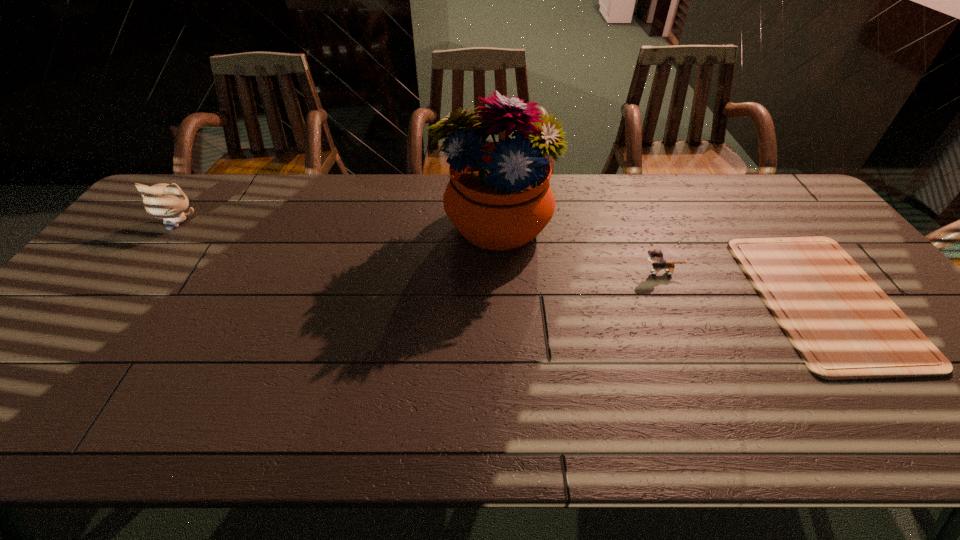
You are a GUI agent. You are given a task and a screenshot of the screen. Output one action in this format:
    pyautogui.click(x=<x>, y=<y>)
    Task: Click on the empty space that is in between the taller kitten and the right kitten
    This screenshot has height=540, width=960.
    Given the screenshot: What is the action you would take?
    pyautogui.click(x=420, y=247)

The image size is (960, 540). In order to click on empty space between the second object from right to left and the leftmost object in this screenshot , I will do `click(420, 247)`.

You are a GUI agent. You are given a task and a screenshot of the screen. Output one action in this format:
    pyautogui.click(x=<x>, y=<y>)
    Task: Click on the free space between the left kitten and the tallest object
    
    Given the screenshot: What is the action you would take?
    pyautogui.click(x=336, y=225)

What are the coordinates of `free space between the right kitten and the taller kitten` in the screenshot? It's located at (420, 247).

Find the location of a particular element. This screenshot has width=960, height=540. empty space that is in between the farther kitten and the flower arrangement is located at coordinates (336, 225).

Identify the location of vacant space in between the nearer kitten and the second object from left to right. (578, 250).

Locate an element on the screen. This screenshot has width=960, height=540. object that ranks as the third closest to the flower arrangement is located at coordinates click(x=166, y=201).

The width and height of the screenshot is (960, 540). Find the location of `the third closest object to the chopping board`. the third closest object to the chopping board is located at coordinates (166, 201).

This screenshot has width=960, height=540. Find the location of `vacant space that satisfies the following two spatial constraints: 1. on the face of the flower arrangement; 2. on the right side of the taller kitten`. vacant space that satisfies the following two spatial constraints: 1. on the face of the flower arrangement; 2. on the right side of the taller kitten is located at coordinates (174, 227).